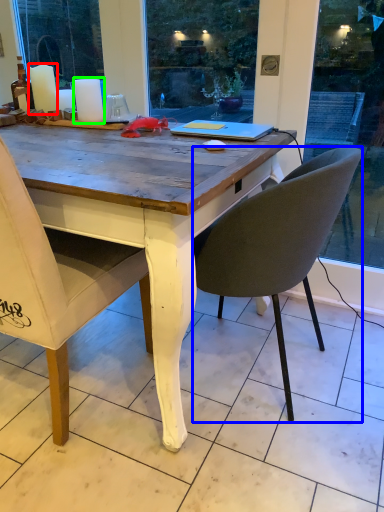
Question: Estimate the real-world distances between objects in this image. Which object is closer to candle (highlighted by a red box), chair (highlighted by a blue box) or candle (highlighted by a green box)?

Choices:
 (A) chair
 (B) candle

Answer: (B)